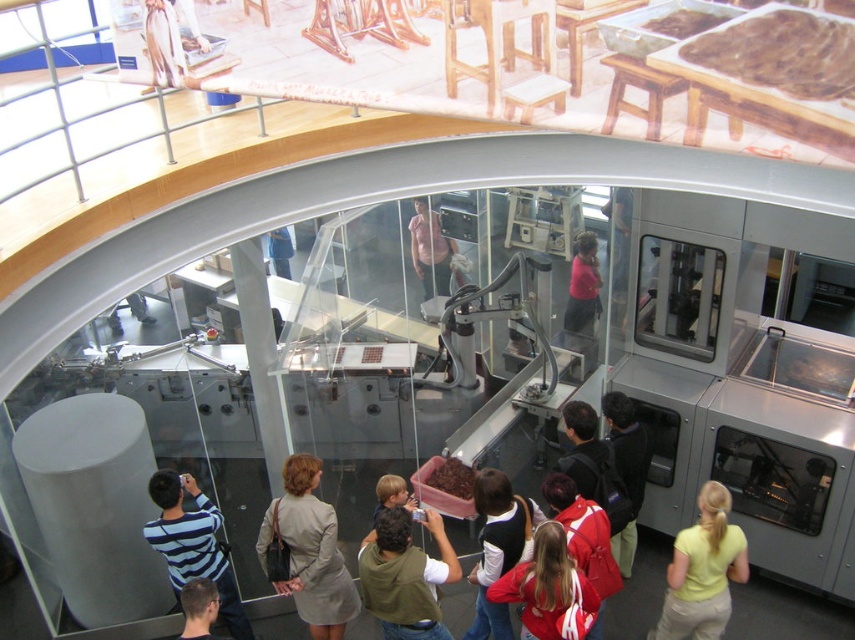
Question: Among these objects, which one is nearest to the camera?

Choices:
 (A) light brown fabric dress at upper left
 (B) matte black jacket at upper center

Answer: (A)

Question: Which object is farther from the camera taking this photo?

Choices:
 (A) matte pink shirt at center
 (B) pink fabric shirt at center
 (C) red fabric jacket at center

Answer: (B)

Question: Can you confirm if green fabric hoodie at center is positioned to the right of red fabric jacket at lower center?

Choices:
 (A) yes
 (B) no

Answer: (B)

Question: Is striped cotton shirt at lower left smaller than black sweater at center?

Choices:
 (A) yes
 (B) no

Answer: (B)

Question: Does matte pink shirt at center have a smaller size compared to matte black jacket at upper center?

Choices:
 (A) no
 (B) yes

Answer: (B)

Question: Among these objects, which one is nearest to the camera?

Choices:
 (A) striped cotton shirt at lower left
 (B) dark blue backpack at lower right

Answer: (A)